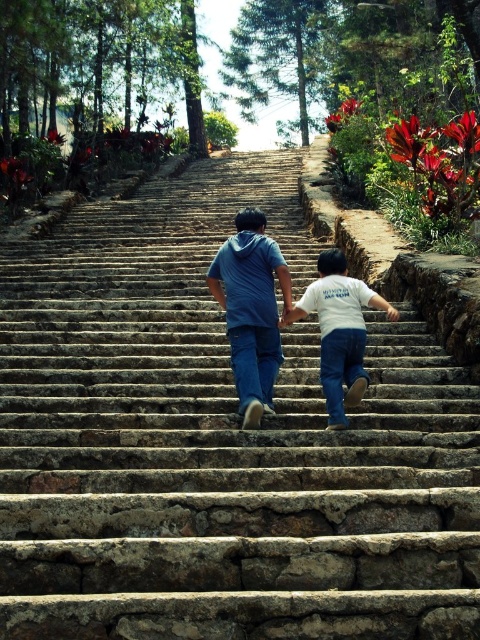
Consider the image. You are standing at the bottom of the staircase and want to take a photo of both the blue denim jeans at center and the white cotton shirt at center. Which one should you focus on first if you want to capture them both in the frame without moving the camera?

You should focus on the blue denim jeans at center first since it is positioned on the left side of the white cotton shirt at center, so capturing it first ensures both are in frame without needing to adjust the camera position.